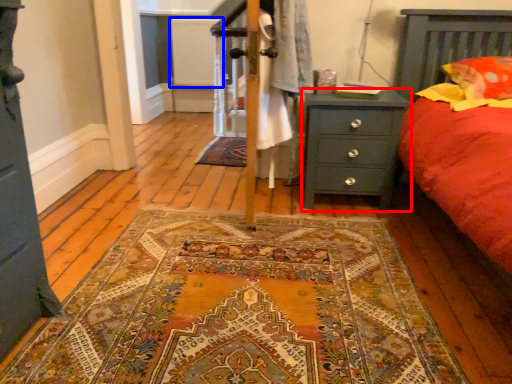
Question: Which of the following is the closest to the observer, nightstand (highlighted by a red box) or radiator (highlighted by a blue box)?

Choices:
 (A) nightstand
 (B) radiator

Answer: (A)